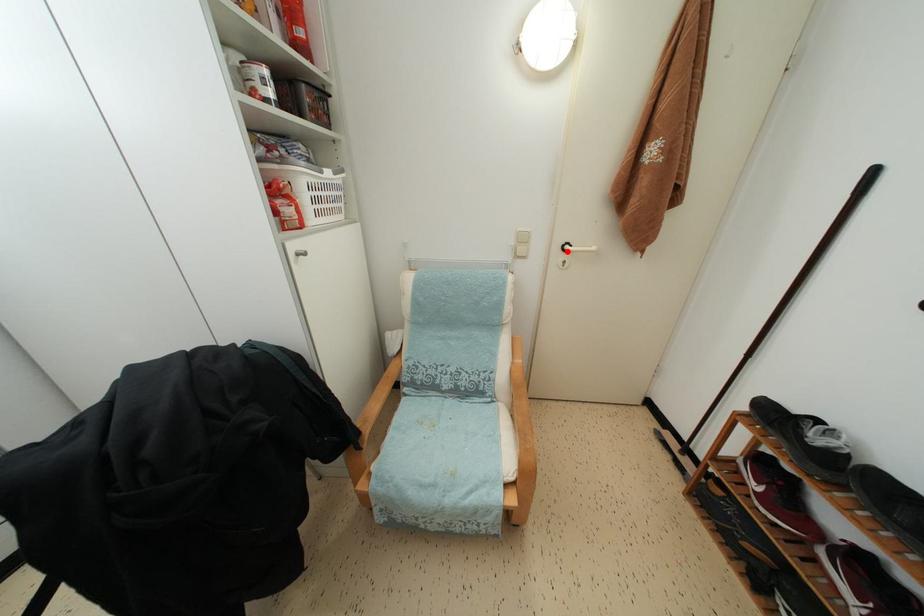
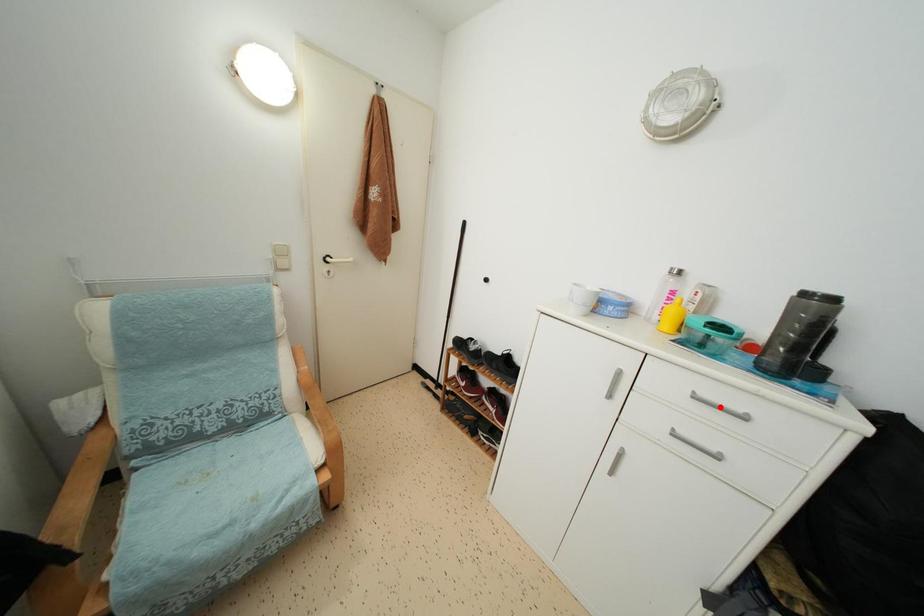
I am providing you with two images of the same scene from different viewpoints. A red point is marked on the first image and another point is marked on the second image. Is the marked point in image1 the same physical position as the marked point in image2?

No